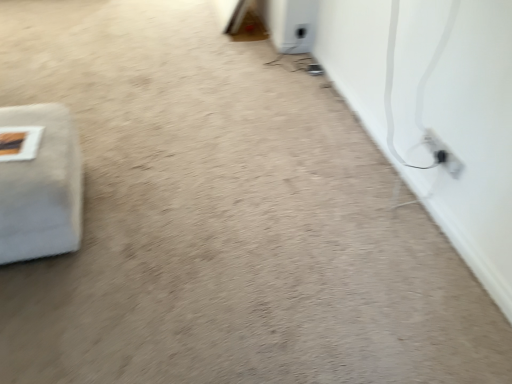
This screenshot has width=512, height=384. What do you see at coordinates (39, 182) in the screenshot?
I see `white fabric at left` at bounding box center [39, 182].

Measure the distance between white fabric at left and camera.

1.40 meters.

Locate an element on the screen. Image resolution: width=512 pixels, height=384 pixels. white fabric at left is located at coordinates (39, 182).

The height and width of the screenshot is (384, 512). Identify the location of black plastic electric outlet at lower right. (443, 154).

This screenshot has width=512, height=384. What do you see at coordinates (443, 154) in the screenshot? I see `black plastic electric outlet at lower right` at bounding box center [443, 154].

In the scene shown: Measure the distance between black plastic electric outlet at lower right and camera.

A: The distance of black plastic electric outlet at lower right from camera is 1.69 meters.

Identify the location of white fabric at left. (39, 182).

Considering the relative positions of white fabric at left and black plastic electric outlet at lower right in the image provided, is white fabric at left to the right of black plastic electric outlet at lower right from the viewer's perspective?

Incorrect, white fabric at left is not on the right side of black plastic electric outlet at lower right.

Relative to black plastic electric outlet at lower right, is white fabric at left in front or behind?

Visually, white fabric at left is located in front of black plastic electric outlet at lower right.

Is point (74, 224) more distant than point (441, 149)?

No, (74, 224) is closer to viewer.

From the image's perspective, would you say white fabric at left is positioned over black plastic electric outlet at lower right?

Incorrect, from the image's perspective, white fabric at left is lower than black plastic electric outlet at lower right.

From a real-world perspective, is white fabric at left below black plastic electric outlet at lower right?

Indeed, from a real-world perspective, white fabric at left is positioned beneath black plastic electric outlet at lower right.

From the picture: In terms of width, does white fabric at left look wider or thinner when compared to black plastic electric outlet at lower right?

In the image, white fabric at left appears to be wider than black plastic electric outlet at lower right.

From the picture: Between white fabric at left and black plastic electric outlet at lower right, which one has more height?

white fabric at left.

Which of these two, white fabric at left or black plastic electric outlet at lower right, is bigger?

white fabric at left is bigger.

Is white fabric at left outside of black plastic electric outlet at lower right?

Yes.

Is white fabric at left far away from black plastic electric outlet at lower right?

That's right, there is a large distance between white fabric at left and black plastic electric outlet at lower right.

Is black plastic electric outlet at lower right at the back of white fabric at left?

That's not correct — white fabric at left is not looking away from black plastic electric outlet at lower right.

Can you tell me how much white fabric at left and black plastic electric outlet at lower right differ in facing direction?

The facing directions of white fabric at left and black plastic electric outlet at lower right are 178 degrees apart.

How much distance is there between white fabric at left and black plastic electric outlet at lower right?

They are 5.23 feet apart.

Identify the location of furniture that appears in front of the black plastic electric outlet at lower right. (39, 182).

Which object is positioned more to the right, black plastic electric outlet at lower right or white fabric at left?

black plastic electric outlet at lower right is more to the right.

Is black plastic electric outlet at lower right in front of or behind white fabric at left in the image?

Clearly, black plastic electric outlet at lower right is behind white fabric at left.

Is point (444, 165) positioned after point (32, 122)?

Yes, it is.

From the image's perspective, between black plastic electric outlet at lower right and white fabric at left, which one is located above?

black plastic electric outlet at lower right is shown above in the image.

From a real-world perspective, is black plastic electric outlet at lower right physically located above or below white fabric at left?

From a real-world perspective, black plastic electric outlet at lower right is physically above white fabric at left.

Considering the relative sizes of black plastic electric outlet at lower right and white fabric at left in the image provided, is black plastic electric outlet at lower right wider than white fabric at left?

In fact, black plastic electric outlet at lower right might be narrower than white fabric at left.

Considering the sizes of objects black plastic electric outlet at lower right and white fabric at left in the image provided, who is shorter, black plastic electric outlet at lower right or white fabric at left?

Standing shorter between the two is black plastic electric outlet at lower right.

Can you confirm if black plastic electric outlet at lower right is bigger than white fabric at left?

Actually, black plastic electric outlet at lower right might be smaller than white fabric at left.

Is black plastic electric outlet at lower right situated inside white fabric at left or outside?

black plastic electric outlet at lower right cannot be found inside white fabric at left.

Is black plastic electric outlet at lower right placed right next to white fabric at left?

black plastic electric outlet at lower right and white fabric at left are not in contact.

Is black plastic electric outlet at lower right facing towards white fabric at left?

Yes.

How many degrees apart are the facing directions of black plastic electric outlet at lower right and white fabric at left?

They differ by 178 degrees in their facing directions.

Consider the image. How distant is black plastic electric outlet at lower right from white fabric at left?

black plastic electric outlet at lower right and white fabric at left are 5.23 feet apart from each other.

Identify the location of electric outlet on the right of white fabric at left. click(x=443, y=154).

Find the location of a particular element. electric outlet located above the white fabric at left (from the image's perspective) is located at coordinates (443, 154).

Locate an element on the screen. furniture in front of the black plastic electric outlet at lower right is located at coordinates (39, 182).